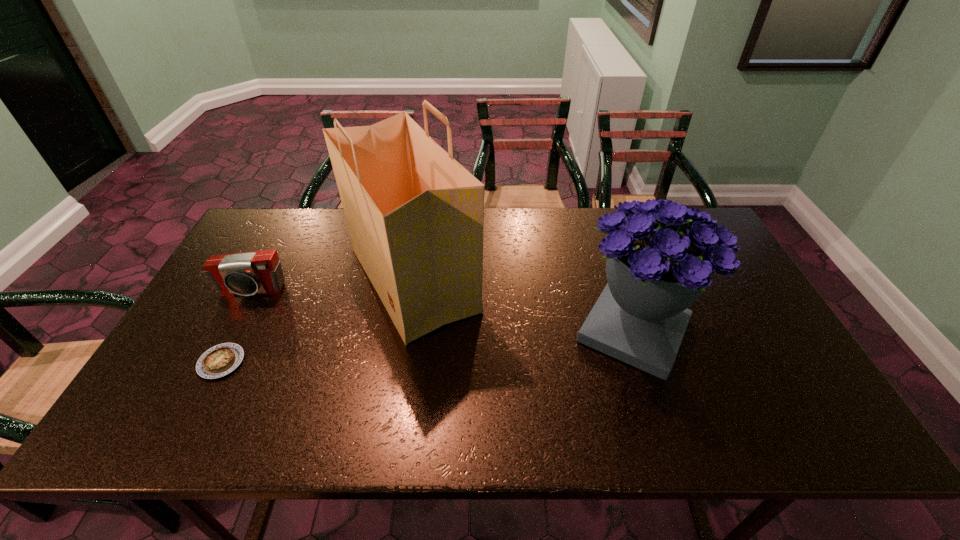
Where is `the tallest object`? This screenshot has height=540, width=960. the tallest object is located at coordinates (415, 216).

The width and height of the screenshot is (960, 540). I want to click on grocery bag, so click(415, 216).

Where is `bouquet`? bouquet is located at coordinates 661,256.

This screenshot has width=960, height=540. What are the coordinates of `the rightmost object` in the screenshot? It's located at (661, 256).

This screenshot has height=540, width=960. I want to click on camera, so click(x=256, y=272).

I want to click on the shortest object, so click(x=220, y=360).

You are a GUI agent. You are given a task and a screenshot of the screen. Output one action in this format:
    pyautogui.click(x=<x>, y=<y>)
    Task: Click on the vacant space located 0.120m on the side of the grocery bag with the superhero design
    The width and height of the screenshot is (960, 540).
    Given the screenshot: What is the action you would take?
    pyautogui.click(x=523, y=279)

This screenshot has width=960, height=540. I want to click on free location located on the back of the third shortest object, so click(x=596, y=215).

Locate an element on the screen. vacant space located on the front-facing side of the camera is located at coordinates (215, 361).

Identify the location of free location located on the right of the quiche. (276, 362).